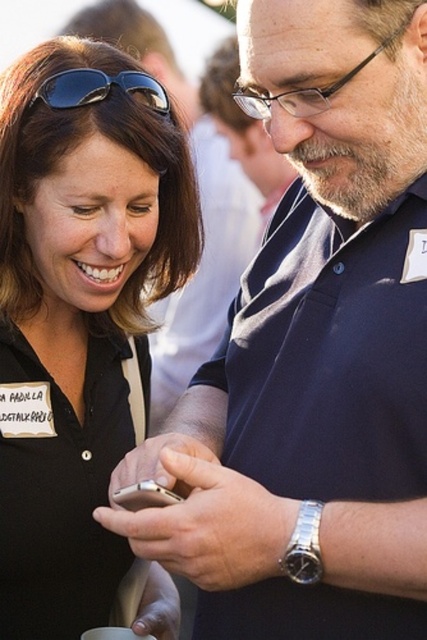
Is matte black shirt at center behind silver metallic smartphone at center?

Yes, matte black shirt at center is behind silver metallic smartphone at center.

Which of these two, matte black shirt at center or silver metallic smartphone at center, stands shorter?

Standing shorter between the two is silver metallic smartphone at center.

Describe the element at coordinates (78, 314) in the screenshot. I see `matte black shirt at center` at that location.

The width and height of the screenshot is (427, 640). I want to click on matte black shirt at center, so click(78, 314).

Can you confirm if matte black shirt at center is positioned to the left of black matte sunglasses at upper left?

Incorrect, matte black shirt at center is not on the left side of black matte sunglasses at upper left.

Does matte black shirt at center have a greater height compared to black matte sunglasses at upper left?

Yes, matte black shirt at center is taller than black matte sunglasses at upper left.

Which is behind, point (60, 250) or point (70, 68)?

Positioned behind is point (60, 250).

Locate an element on the screen. This screenshot has width=427, height=640. matte black shirt at center is located at coordinates (78, 314).

Which is more to the right, black matte sunglasses at upper left or silver metallic smartphone at center?

Positioned to the right is silver metallic smartphone at center.

Between black matte sunglasses at upper left and silver metallic smartphone at center, which one has less height?

silver metallic smartphone at center is shorter.

Is point (50, 92) positioned after point (125, 506)?

That is True.

Locate an element on the screen. black matte sunglasses at upper left is located at coordinates (101, 90).